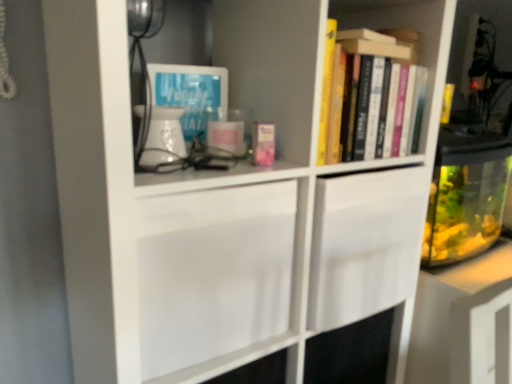
Question: From a real-world perspective, is hardcover books at upper right, which appears as the 2th book when viewed from the front, beneath white plastic corded phone at upper left?

Choices:
 (A) yes
 (B) no

Answer: (A)

Question: Is hardcover books at upper right, the first book in the back-to-front sequence, placed right next to white plastic corded phone at upper left?

Choices:
 (A) yes
 (B) no

Answer: (B)

Question: Is white plastic corded phone at upper left surrounded by hardcover books at upper right, the first book in the back-to-front sequence?

Choices:
 (A) no
 (B) yes

Answer: (A)

Question: From the image's perspective, is hardcover books at upper right, the first book in the back-to-front sequence, over white plastic corded phone at upper left?

Choices:
 (A) no
 (B) yes

Answer: (A)

Question: Is hardcover books at upper right, the first book positioned from the right, at the right side of white plastic corded phone at upper left?

Choices:
 (A) yes
 (B) no

Answer: (A)

Question: Considering the relative sizes of hardcover books at upper right, marked as the 2th book in a left-to-right arrangement, and white plastic corded phone at upper left in the image provided, is hardcover books at upper right, marked as the 2th book in a left-to-right arrangement, taller than white plastic corded phone at upper left?

Choices:
 (A) yes
 (B) no

Answer: (B)

Question: From the image's perspective, is white plastic corded phone at upper left over hardcover books at upper right, which appears as the 2th book when viewed from the front?

Choices:
 (A) no
 (B) yes

Answer: (B)

Question: Is white plastic corded phone at upper left positioned in front of hardcover books at upper right, marked as the 2th book in a left-to-right arrangement?

Choices:
 (A) no
 (B) yes

Answer: (B)

Question: Is hardcover books at upper right, the first book in the back-to-front sequence, a part of white plastic corded phone at upper left?

Choices:
 (A) no
 (B) yes

Answer: (A)

Question: Considering the relative sizes of white plastic corded phone at upper left and hardcover books at upper right, the first book positioned from the right, in the image provided, is white plastic corded phone at upper left bigger than hardcover books at upper right, the first book positioned from the right,?

Choices:
 (A) yes
 (B) no

Answer: (B)

Question: Considering the relative sizes of white plastic corded phone at upper left and hardcover books at upper right, which appears as the 2th book when viewed from the front, in the image provided, is white plastic corded phone at upper left smaller than hardcover books at upper right, which appears as the 2th book when viewed from the front,?

Choices:
 (A) yes
 (B) no

Answer: (A)

Question: Can you confirm if white plastic corded phone at upper left is shorter than hardcover books at upper right, which appears as the 2th book when viewed from the front?

Choices:
 (A) yes
 (B) no

Answer: (B)

Question: Does transparent glass fish tank at right have a lesser height compared to hardcover books at upper right, the first book in the back-to-front sequence?

Choices:
 (A) no
 (B) yes

Answer: (A)